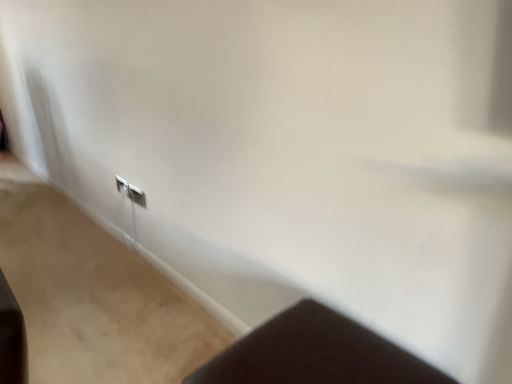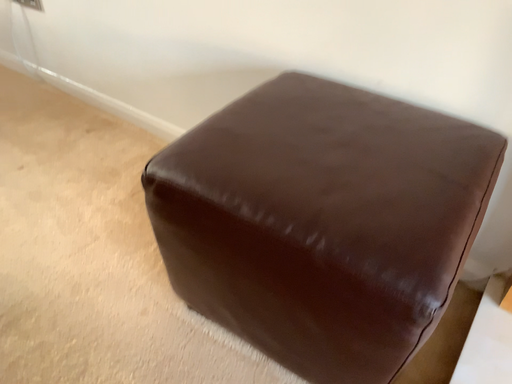
Question: Which way did the camera rotate in the video?

Choices:
 (A) rotated right
 (B) rotated left

Answer: (A)